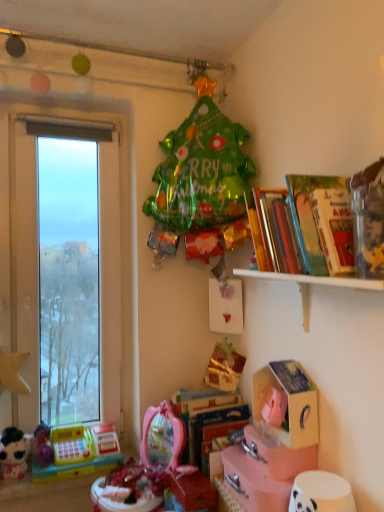
Find the location of a particular element. The width and height of the screenshot is (384, 512). vacant area on top of transparent glass window at left (from a real-world perspective) is located at coordinates (53, 108).